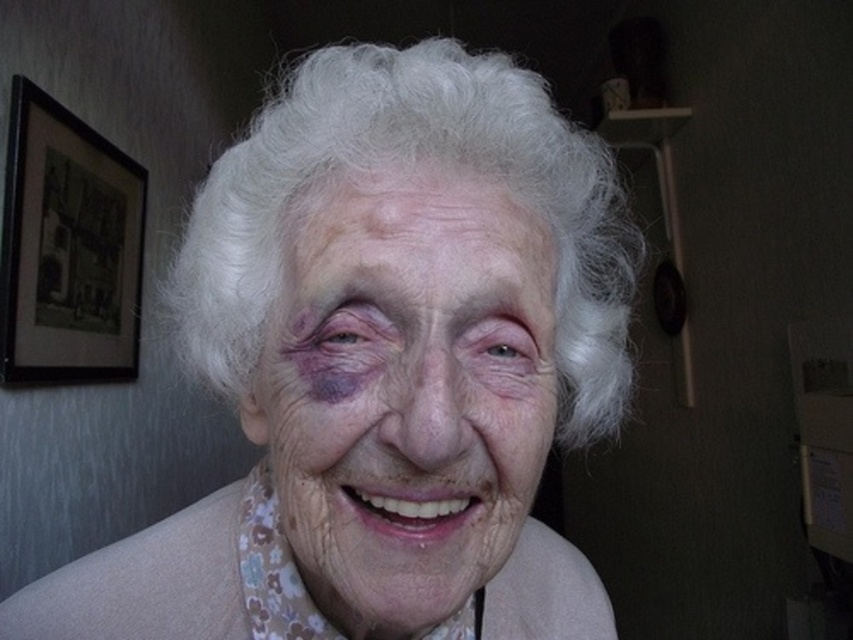
You are an interior designer assessing the space. You need to hang a new decorative item that is the same width as the black matte picture frame at upper left. Can you place it next to the dry skin at center without overlapping?

The black matte picture frame at upper left is narrower than the dry skin at center, so placing an item of the same width next to it would fit without overlapping.

Based on the scene description, can you determine which object is located above the other between the white textured hair at center and the dry skin at center?

The white textured hair at center is positioned over dry skin at center, so the white textured hair is above the dry skin.

You are an interior designer assessing the placement of items in a room. You notice the black matte picture frame at upper left and the dry skin at center. Which object is closer to you from your current viewpoint?

The black matte picture frame at upper left is closer to you than the dry skin at center because it is further to the viewer.